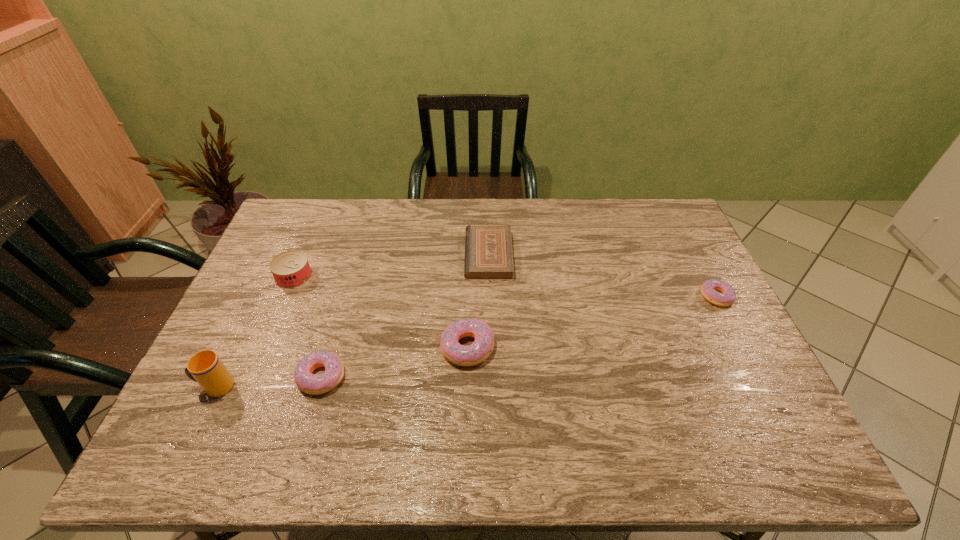
At what (x,y) coordinates should I click in order to perform the action: click on the second tallest doughnut. Please return your answer as a coordinate pair (x, y). This screenshot has width=960, height=540. Looking at the image, I should click on (314, 384).

Image resolution: width=960 pixels, height=540 pixels. I want to click on the fourth object from right to left, so click(x=314, y=384).

Where is `the second doughnut from left to right`? This screenshot has height=540, width=960. the second doughnut from left to right is located at coordinates (475, 353).

Where is `the shortest doughnut`? The height and width of the screenshot is (540, 960). the shortest doughnut is located at coordinates (728, 296).

Identify the location of the farthest doughnut. (728, 296).

This screenshot has height=540, width=960. What are the coordinates of `can` in the screenshot? It's located at (290, 269).

This screenshot has width=960, height=540. Identify the location of Bible. (488, 248).

This screenshot has height=540, width=960. Identify the location of cup. (205, 367).

You are a GUI agent. You are given a task and a screenshot of the screen. Output one action in this format:
    pyautogui.click(x=<x>, y=<y>)
    Task: Click on the vacant space located on the back of the third shortest object
    
    Given the screenshot: What is the action you would take?
    pyautogui.click(x=348, y=289)

Locate an element on the screen. This screenshot has height=540, width=960. vacant space situated 0.170m on the left of the tallest doughnut is located at coordinates (379, 347).